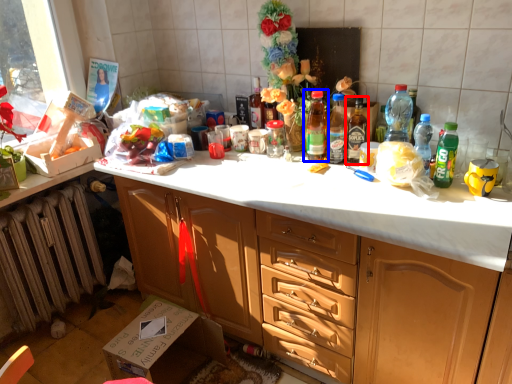
Question: Among these objects, which one is nearest to the camera, bottle (highlighted by a red box) or bottle (highlighted by a blue box)?

Choices:
 (A) bottle
 (B) bottle

Answer: (A)